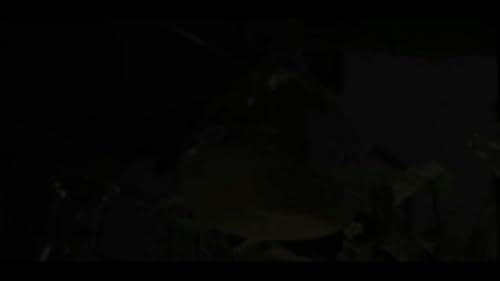
What are the coordinates of `white surface` in the screenshot? It's located at (288, 233).